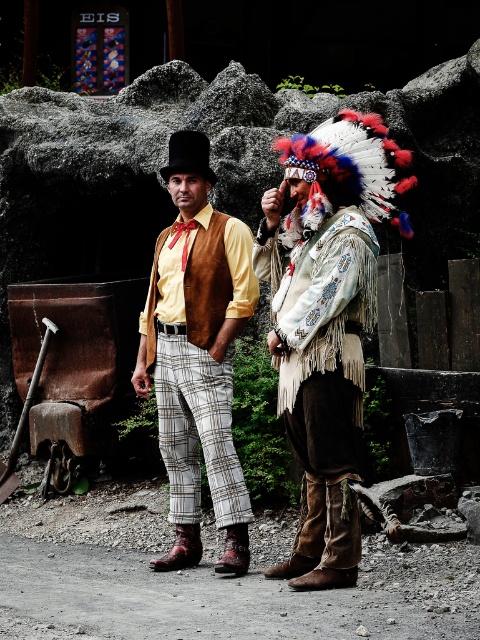
Question: Can you confirm if white fringed leather jacket at center is smaller than matte brown vest at center?

Choices:
 (A) no
 (B) yes

Answer: (B)

Question: Among these points, which one is nearest to the camera?

Choices:
 (A) (167, 380)
 (B) (286, 173)

Answer: (B)

Question: Is white fringed leather jacket at center closer to camera compared to matte brown vest at center?

Choices:
 (A) no
 (B) yes

Answer: (B)

Question: Is white fringed leather jacket at center positioned at the back of matte brown vest at center?

Choices:
 (A) no
 (B) yes

Answer: (A)

Question: Which point is closer to the camera?

Choices:
 (A) matte brown vest at center
 (B) white fringed leather jacket at center

Answer: (B)

Question: Which point appears closest to the camera in this image?

Choices:
 (A) (365, 253)
 (B) (208, 422)

Answer: (A)